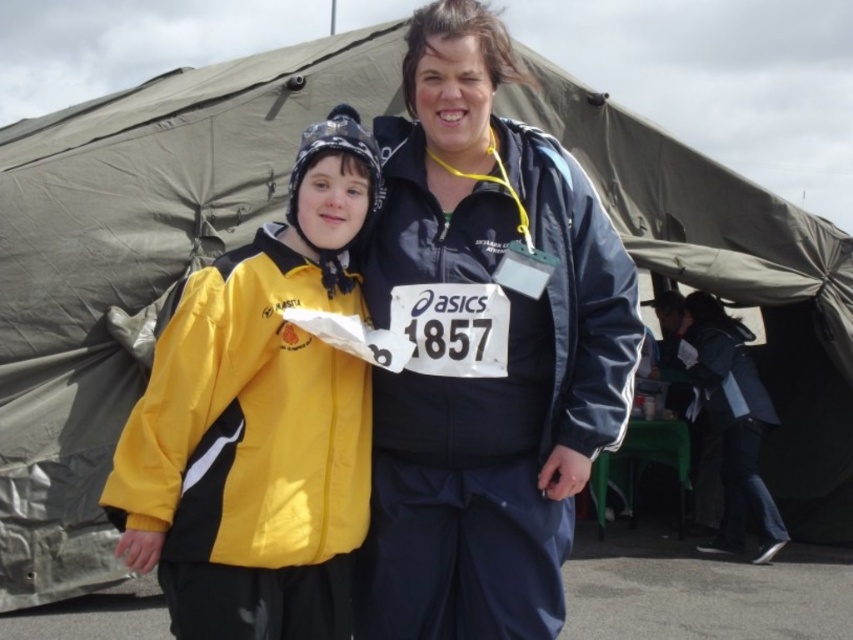
You are standing in front of the large tarp structure where two people are posing. You need to locate the matte blue jacket at center. Where exactly would you look to find it?

The matte blue jacket at center is located at point 0.547 on the x axis and 0.569 on the y axis.

You are a photographer setting up a photo shoot under the tarp structure. You need to position a 1.2m tall tripod between the two jackets so that it doesn t block either of them. Given the height difference between the matte blue jacket at center and the yellow matte jacket at center, which jacket will the tripod be closer to?

The matte blue jacket at center is taller than the yellow matte jacket at center. Since the tripod is 1.2m tall, it should be placed closer to the shorter yellow matte jacket at center to avoid blocking the taller matte blue jacket at center.

You are a photographer trying to capture a group photo of the two people in the image. The matte blue jacket at center and the yellow matte jacket at center are both in the frame. If you want to ensure both jackets are clearly visible, which jacket should you focus on first and why?

The matte blue jacket at center is larger in size than the yellow matte jacket at center, so you should focus on the yellow matte jacket at center first because it is smaller and might be harder to capture clearly in the frame.